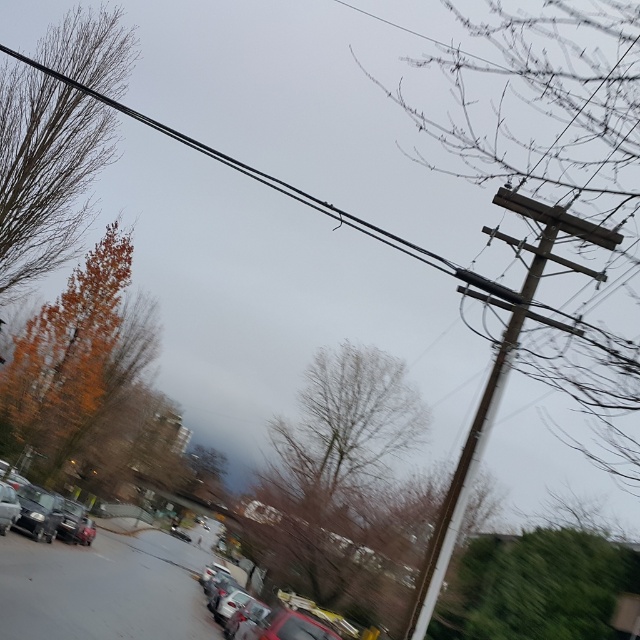
Is orange leafy tree at left below metallic red car at center?

No.

Who is shorter, orange leafy tree at left or metallic red car at center?

orange leafy tree at left

Find the location of a particular element. The width and height of the screenshot is (640, 640). orange leafy tree at left is located at coordinates (45, 170).

Find the location of a particular element. orange leafy tree at left is located at coordinates (45, 170).

From the picture: Is brown wooden telegraph pole at right to the left of metallic red car at center from the viewer's perspective?

No, brown wooden telegraph pole at right is not to the left of metallic red car at center.

Is brown wooden telegraph pole at right to the right of metallic red car at center from the viewer's perspective?

Yes, brown wooden telegraph pole at right is to the right of metallic red car at center.

Locate an element on the screen. This screenshot has width=640, height=640. brown wooden telegraph pole at right is located at coordinates (497, 381).

Which of these two, bare branches at center or black wire at upper center, stands taller?

With more height is black wire at upper center.

Which is more to the left, bare branches at center or black wire at upper center?

From the viewer's perspective, black wire at upper center appears more on the left side.

This screenshot has height=640, width=640. In order to click on bare branches at center in this screenshot , I will do `click(333, 476)`.